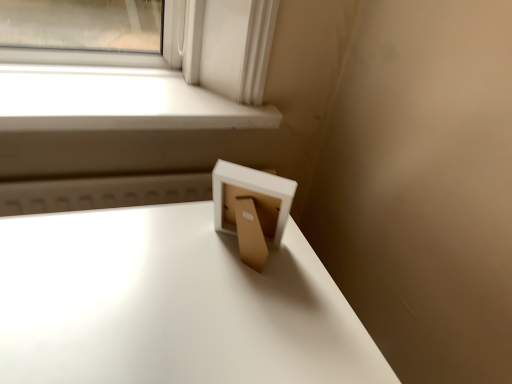
Question: Can you see white matte window sill at upper left touching white glossy table at center?

Choices:
 (A) yes
 (B) no

Answer: (B)

Question: Is white matte window sill at upper left not near white glossy table at center?

Choices:
 (A) no
 (B) yes

Answer: (A)

Question: Can you confirm if white matte window sill at upper left is positioned to the left of white glossy table at center?

Choices:
 (A) yes
 (B) no

Answer: (A)

Question: Does white matte window sill at upper left have a larger size compared to white glossy table at center?

Choices:
 (A) yes
 (B) no

Answer: (B)

Question: From a real-world perspective, does white matte window sill at upper left sit lower than white glossy table at center?

Choices:
 (A) yes
 (B) no

Answer: (B)

Question: Is white matte window sill at upper left further to camera compared to white glossy table at center?

Choices:
 (A) yes
 (B) no

Answer: (A)

Question: Would you consider white glossy table at center to be distant from white matte window sill at upper left?

Choices:
 (A) yes
 (B) no

Answer: (B)

Question: Is white glossy table at center shorter than white matte window sill at upper left?

Choices:
 (A) no
 (B) yes

Answer: (A)

Question: Can you confirm if white glossy table at center is positioned to the right of white matte window sill at upper left?

Choices:
 (A) no
 (B) yes

Answer: (B)

Question: Is white glossy table at center facing towards white matte window sill at upper left?

Choices:
 (A) no
 (B) yes

Answer: (A)

Question: Does white glossy table at center have a lesser width compared to white matte window sill at upper left?

Choices:
 (A) no
 (B) yes

Answer: (A)

Question: From a real-world perspective, is white glossy table at center positioned under white matte window sill at upper left based on gravity?

Choices:
 (A) no
 (B) yes

Answer: (B)

Question: Is white matte window sill at upper left situated inside white glossy table at center or outside?

Choices:
 (A) outside
 (B) inside

Answer: (A)